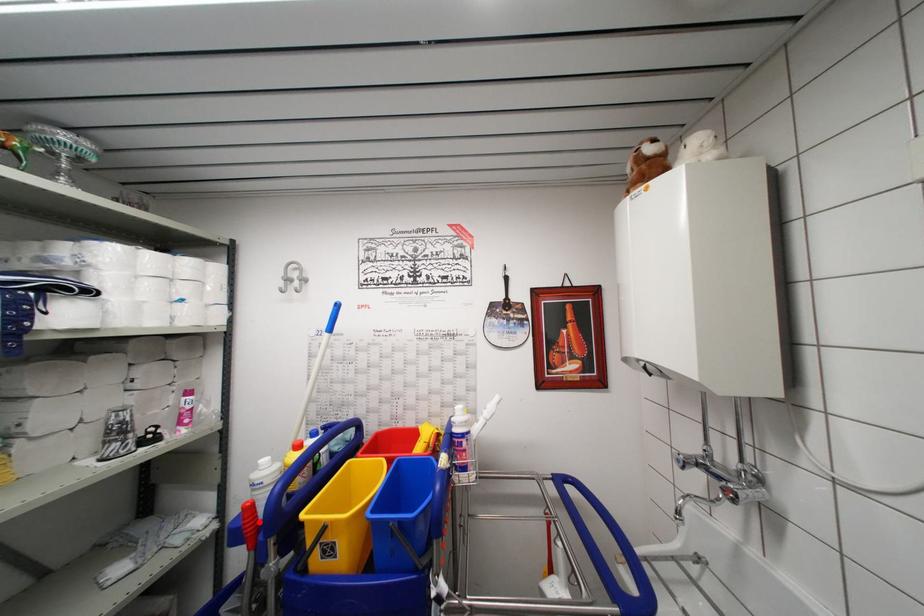
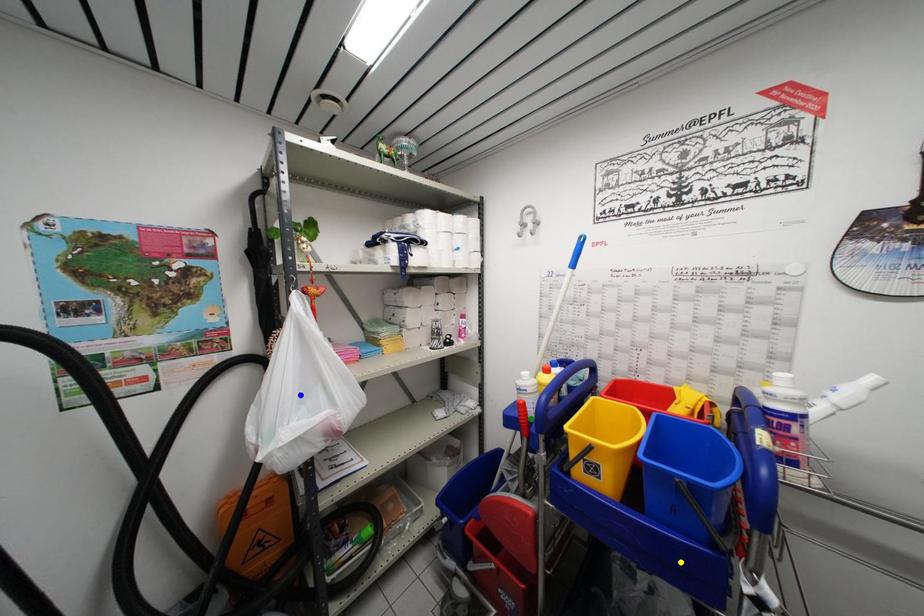
Question: I am providing you with two images of the same scene from different viewpoints. A red point is marked on the first image. You are given multiple points on the second image. Which spot in image 2 lines up with the point in image 1?

Choices:
 (A) green point
 (B) blue point
 (C) yellow point

Answer: (A)